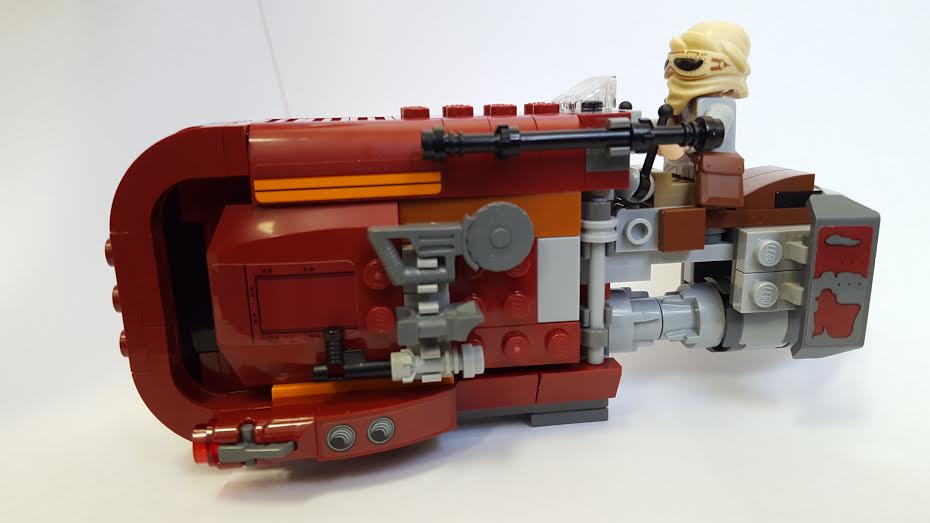
Where is `shades`? This screenshot has height=523, width=930. shades is located at coordinates (693, 64).